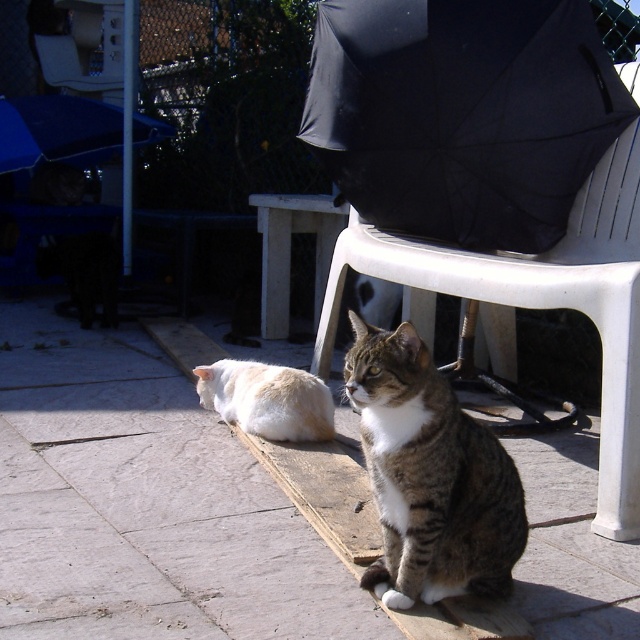
Who is more distant from viewer, (385, 461) or (67, 109)?

The point (67, 109) is more distant.

Can you confirm if tabby fur cat at center is thinner than blue fabric umbrella at upper left?

Correct, tabby fur cat at center's width is less than blue fabric umbrella at upper left's.

Which is behind, point (440, 547) or point (122, 124)?

Positioned behind is point (122, 124).

Locate an element on the screen. tabby fur cat at center is located at coordinates [429, 476].

Does black fabric umbrella at upper center lie behind white plastic chair at center?

Yes, black fabric umbrella at upper center is behind white plastic chair at center.

Is black fabric umbrella at upper center below white plastic chair at center?

No, black fabric umbrella at upper center is not below white plastic chair at center.

Who is more distant from viewer, (508,122) or (419,317)?

Positioned behind is point (419,317).

Find the location of a particular element. black fabric umbrella at upper center is located at coordinates (461, 115).

Who is more forward, (241, 417) or (266, 260)?

Point (241, 417) is in front.

Locate an element on the screen. The height and width of the screenshot is (640, 640). white fluffy cat at lower left is located at coordinates (268, 400).